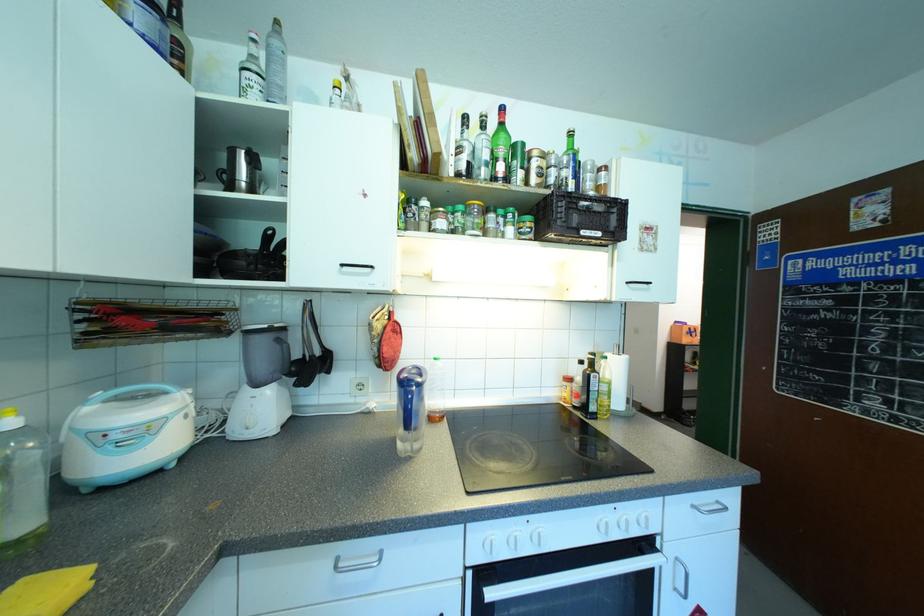
Find where to push the white pump dispenser. Please return your answer as a coordinate pair (x, y).

(261, 383)